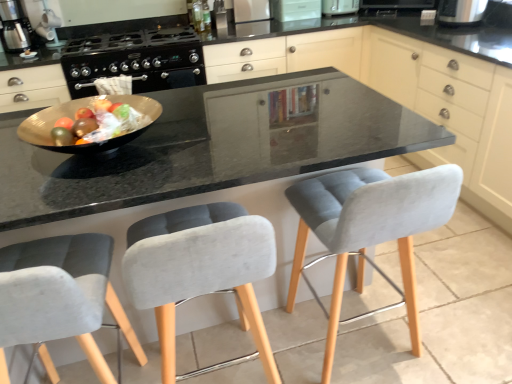
Question: From a real-world perspective, is white plastic toaster at upper center, which ranks as the 4th appliance in left-to-right order, beneath matte gray cabinet at center, which ranks as the 1th cabinetry in left-to-right order?

Choices:
 (A) no
 (B) yes

Answer: (A)

Question: Can you confirm if white plastic toaster at upper center, which ranks as the 4th appliance in left-to-right order, is taller than matte gray cabinet at center, which ranks as the 1th cabinetry in left-to-right order?

Choices:
 (A) no
 (B) yes

Answer: (A)

Question: Is matte gray cabinet at center, which ranks as the 1th cabinetry in left-to-right order, inside white plastic toaster at upper center, placed as the 2th appliance when sorted from right to left?

Choices:
 (A) yes
 (B) no

Answer: (B)

Question: From a real-world perspective, is white plastic toaster at upper center, placed as the 2th appliance when sorted from right to left, over matte gray cabinet at center, which ranks as the 1th cabinetry in left-to-right order?

Choices:
 (A) no
 (B) yes

Answer: (B)

Question: Is white plastic toaster at upper center, which ranks as the 4th appliance in left-to-right order, outside matte gray cabinet at center, which ranks as the 1th cabinetry in left-to-right order?

Choices:
 (A) no
 (B) yes

Answer: (B)

Question: Considering the positions of metallic silver coffee maker at upper left and satin silver refrigerator at upper center, positioned as the fourth appliance in right-to-left order, in the image, is metallic silver coffee maker at upper left bigger or smaller than satin silver refrigerator at upper center, positioned as the fourth appliance in right-to-left order,?

Choices:
 (A) big
 (B) small

Answer: (A)

Question: Based on their positions, is metallic silver coffee maker at upper left located to the left or right of satin silver refrigerator at upper center, positioned as the fourth appliance in right-to-left order?

Choices:
 (A) right
 (B) left

Answer: (B)

Question: Is metallic silver coffee maker at upper left situated inside satin silver refrigerator at upper center, which is the second appliance in left-to-right order, or outside?

Choices:
 (A) outside
 (B) inside

Answer: (A)

Question: From their relative heights in the image, would you say metallic silver coffee maker at upper left is taller or shorter than satin silver refrigerator at upper center, which is the second appliance in left-to-right order?

Choices:
 (A) tall
 (B) short

Answer: (A)

Question: Which is correct: black plastic toaster at upper right, the fifth appliance positioned from the left, is inside velvet grey chair at lower left, which is the 1th chair in left-to-right order, or outside of it?

Choices:
 (A) outside
 (B) inside

Answer: (A)

Question: From the image's perspective, relative to velvet grey chair at lower left, which is the 1th chair in left-to-right order, is black plastic toaster at upper right, the fifth appliance positioned from the left, above or below?

Choices:
 (A) below
 (B) above

Answer: (B)

Question: Is point (475, 23) positioned closer to the camera than point (76, 319)?

Choices:
 (A) farther
 (B) closer

Answer: (A)

Question: Visually, is black plastic toaster at upper right, the first appliance when ordered from right to left, positioned to the left or to the right of velvet grey chair at lower left, the 3th chair from the right?

Choices:
 (A) right
 (B) left

Answer: (A)

Question: From a real-world perspective, is shiny gold bowl at center positioned above or below white glossy microwave at upper center, placed as the 3th appliance when sorted from left to right?

Choices:
 (A) above
 (B) below

Answer: (A)

Question: In the image, is shiny gold bowl at center positioned in front of or behind white glossy microwave at upper center, placed as the 3th appliance when sorted from left to right?

Choices:
 (A) front
 (B) behind

Answer: (A)